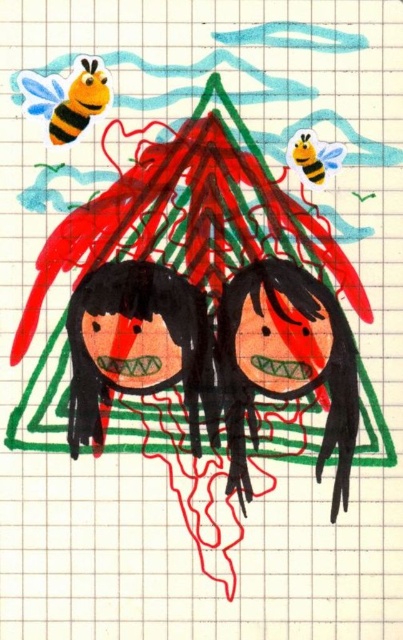
Question: Does black matte doll at center appear on the left side of smooth black doll at center?

Choices:
 (A) no
 (B) yes

Answer: (A)

Question: Based on their relative distances, which object is nearer to the smooth black doll at center?

Choices:
 (A) yellow striped bee at upper left
 (B) black matte doll at center

Answer: (B)

Question: Can you confirm if black matte doll at center is thinner than yellow striped bee at upper left?

Choices:
 (A) no
 (B) yes

Answer: (A)

Question: Which of the following is the closest to the observer?

Choices:
 (A) (182, 280)
 (B) (85, 83)

Answer: (B)

Question: Which of these objects is positioned farthest from the black matte doll at center?

Choices:
 (A) smooth black doll at center
 (B) yellow striped bee at upper left

Answer: (B)

Question: Is smooth black doll at center wider than yellow striped bee at upper left?

Choices:
 (A) yes
 (B) no

Answer: (A)